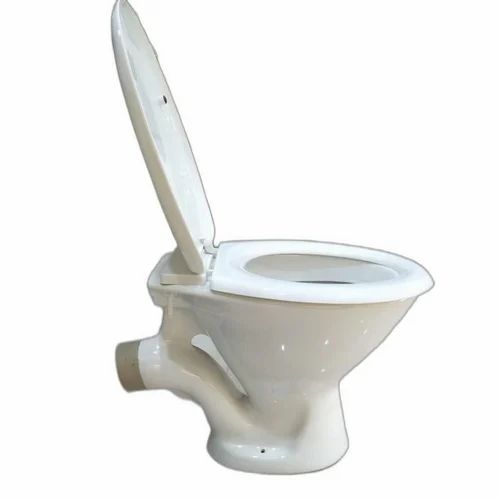
Locate an element on the screen. The height and width of the screenshot is (500, 500). toilet slammer stopper is located at coordinates (164, 100).